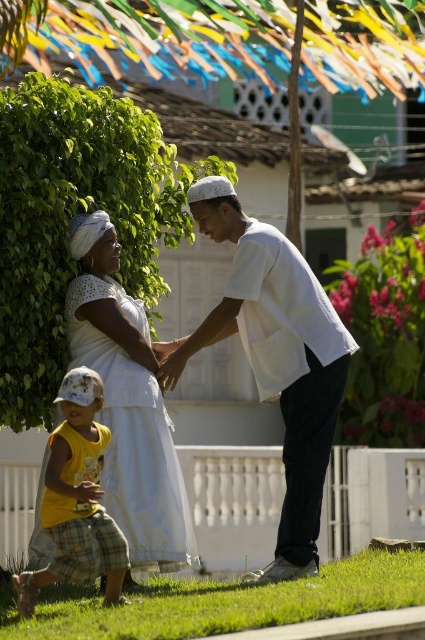
Question: Does white cotton dress at center appear under green grass at lower center?

Choices:
 (A) no
 (B) yes

Answer: (A)

Question: Can you confirm if white cotton shirt at center is wider than white cotton dress at center?

Choices:
 (A) no
 (B) yes

Answer: (A)

Question: Among these objects, which one is farthest from the camera?

Choices:
 (A) yellow cotton shirt at lower left
 (B) green grass at lower center
 (C) white cotton dress at center
 (D) white cotton shirt at center

Answer: (D)

Question: Does green leafy tree at upper left appear on the left side of yellow cotton shirt at lower left?

Choices:
 (A) yes
 (B) no

Answer: (A)

Question: Which object is the closest to the yellow cotton shirt at lower left?

Choices:
 (A) white cotton dress at center
 (B) green grass at lower center
 (C) white cotton shirt at center

Answer: (B)

Question: Which point is farther to the camera?

Choices:
 (A) (56, 436)
 (B) (144, 150)
 (C) (204, 230)
 (D) (76, 339)

Answer: (B)